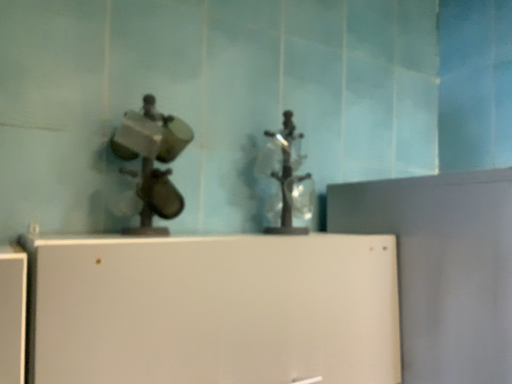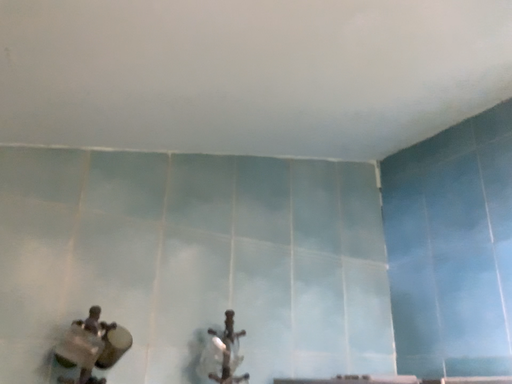
Question: Which way did the camera rotate in the video?

Choices:
 (A) rotated upward
 (B) rotated downward

Answer: (A)